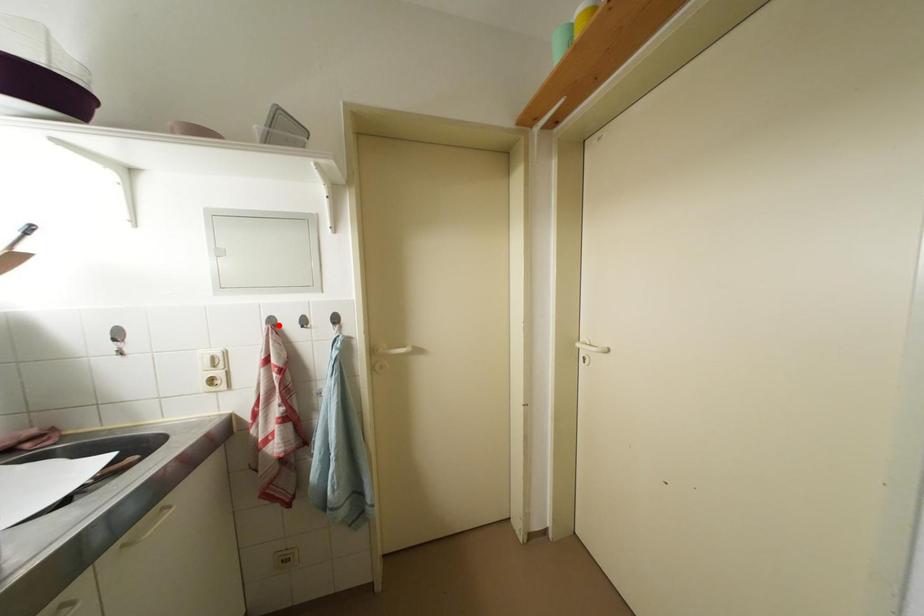
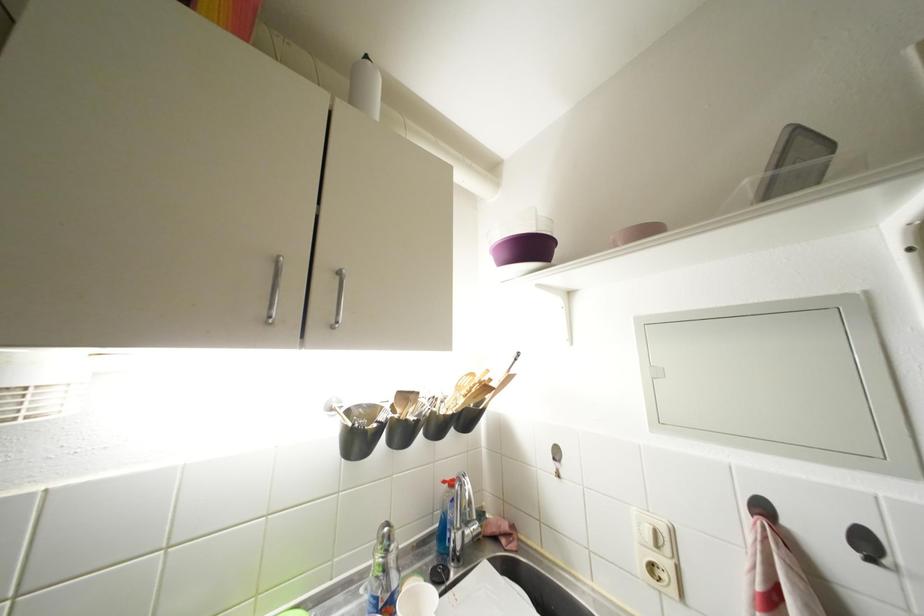
Find the pixel in the second image that matches the highlighted location in the first image.

(770, 513)